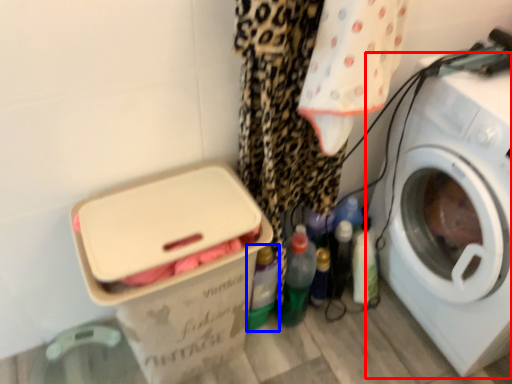
Question: Which object appears closest to the camera in this image, washing machine (highlighted by a red box) or bottle (highlighted by a blue box)?

Choices:
 (A) washing machine
 (B) bottle

Answer: (A)